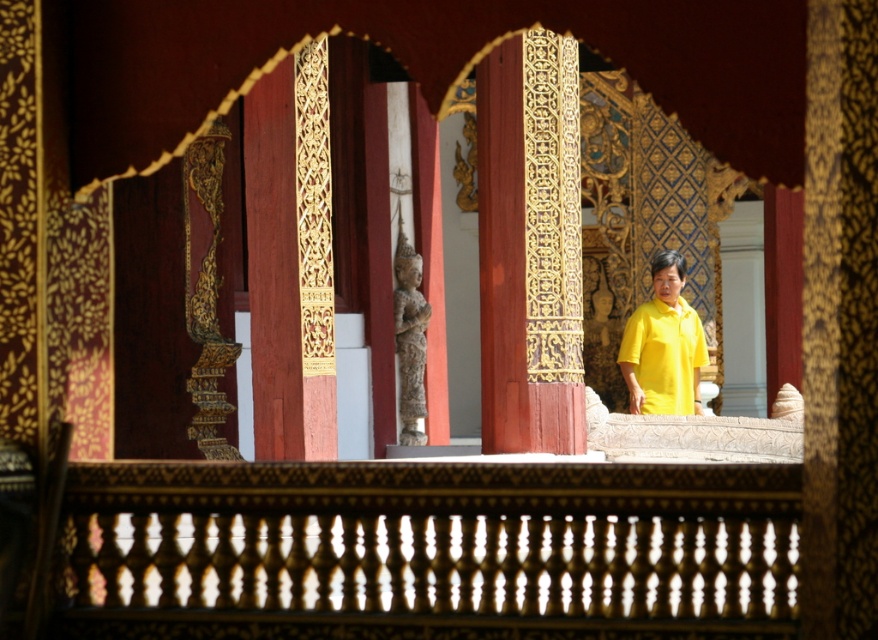
You are an interior designer assessing the space through the archways. You notice the wooden carved rail at center and the yellow matte shirt at center. Which object is taller when viewed from the entrance?

The yellow matte shirt at center is taller than the wooden carved rail at center.

What is the object located at the coordinates point [430,550] in the image?

The point [430,550] indicates a wooden carved rail at center.